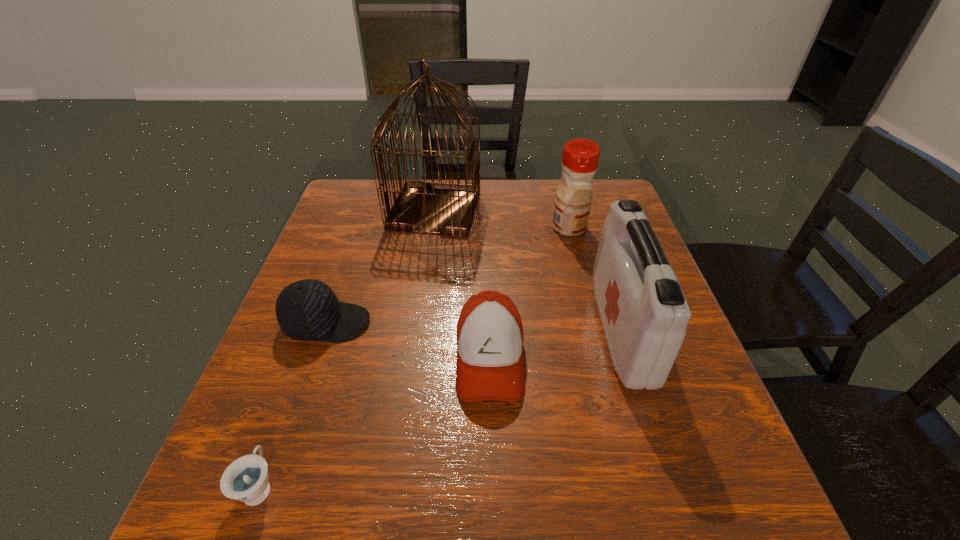
Point out which object is positioned as the nearest to the right baseball cap. Please provide its 2D coordinates. Your answer should be formatted as a tuple, i.e. [(x, y)], where the tuple contains the x and y coordinates of a point satisfying the conditions above.

[(644, 314)]

Select which object appears as the fifth closest to the teacup. Please provide its 2D coordinates. Your answer should be formatted as a tuple, i.e. [(x, y)], where the tuple contains the x and y coordinates of a point satisfying the conditions above.

[(580, 157)]